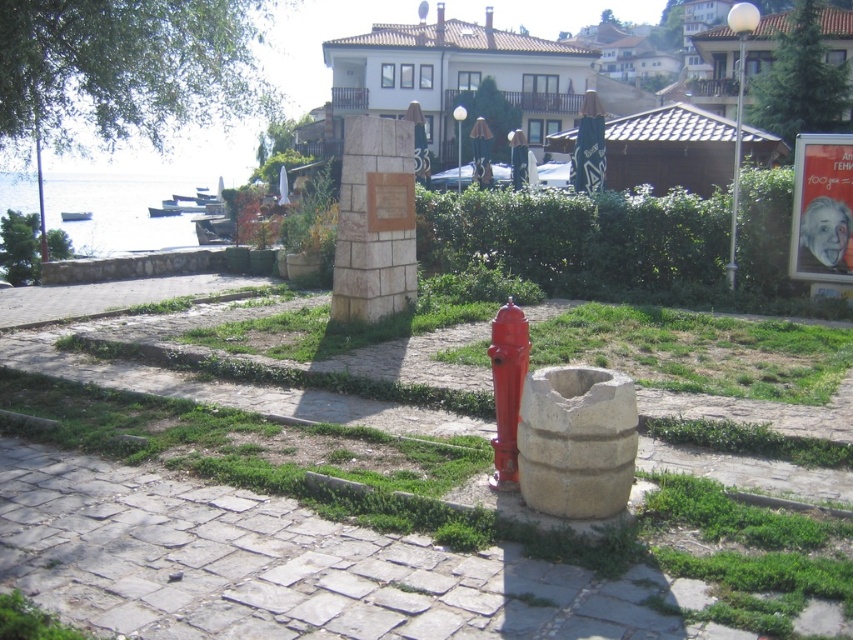
Question: Is green grass at center in front of stone plaque at center?

Choices:
 (A) no
 (B) yes

Answer: (B)

Question: Is blue water at left smaller than red matte hydrant at center?

Choices:
 (A) yes
 (B) no

Answer: (B)

Question: Which object is closer to the camera taking this photo?

Choices:
 (A) blue water at left
 (B) red matte hydrant at center

Answer: (B)

Question: Is the position of blue water at left less distant than that of white stone plaque at center?

Choices:
 (A) yes
 (B) no

Answer: (B)

Question: Which of the following is the closest to the observer?

Choices:
 (A) stone plaque at center
 (B) red matte hydrant at center
 (C) green grass at center
 (D) white stone plaque at center

Answer: (C)

Question: Which point is farther to the camera?

Choices:
 (A) (41, 456)
 (B) (160, 248)

Answer: (B)